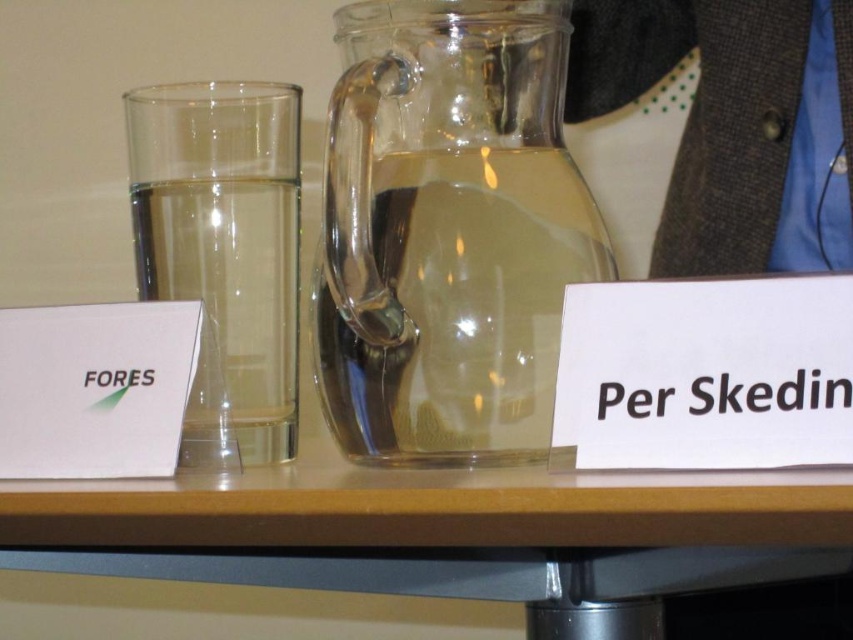
You are at a table with two glasses. The first is a tall glass with a card labeled Fores, and the second is a larger pitcher with a card labeled Per Skedin. A point at coordinates (224, 248) is marked. Which object does this point correspond to?

The point at coordinates (224, 248) corresponds to the clear glass pitcher at center, as stated in the objects description.

You are arranging items on a table and need to place a new object between the clear glass pitcher at center and the green paper at left. Based on their widths, which item should you place closer to the narrower one to maintain balance?

The green paper at left is narrower than the clear glass pitcher at center. To maintain balance, place the new object closer to the green paper at left since it is narrower.

Looking at this image, what are the coordinates of the transparent glass table at center?

The transparent glass table at center is located at coordinates point (381, 544).